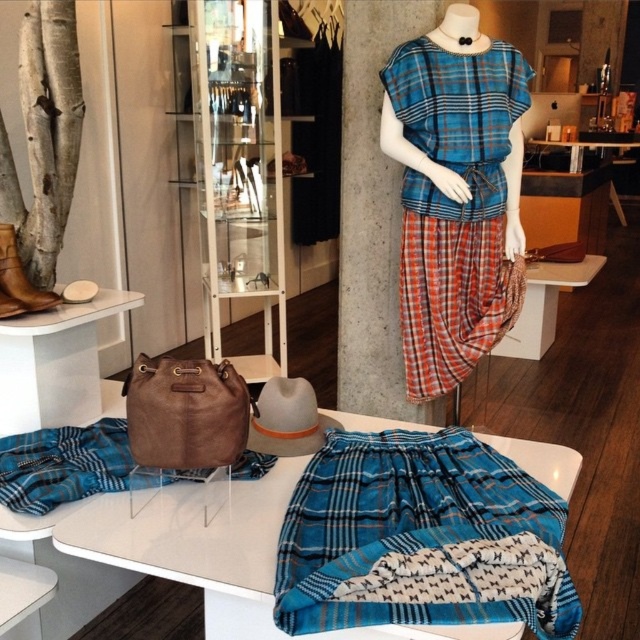
Can you confirm if blue plaid skirt at center is positioned above blue plaid dress at center?

No.

Is point (342, 496) behind point (449, 212)?

No, (342, 496) is closer to viewer.

Is point (390, 509) positioned in front of point (456, 49)?

Yes, it is in front of point (456, 49).

Locate an element on the screen. This screenshot has width=640, height=640. blue plaid skirt at center is located at coordinates (420, 538).

Is point (449, 349) positioned after point (13, 262)?

Yes.

Between blue plaid dress at center and brown leather boot at left, which one is positioned lower?

Positioned lower is brown leather boot at left.

I want to click on blue plaid dress at center, so click(454, 192).

This screenshot has height=640, width=640. Find the location of `blue plaid dress at center`. blue plaid dress at center is located at coordinates (454, 192).

Does blue plaid skirt at center appear on the right side of suede plaid skirt at lower left?

Yes, blue plaid skirt at center is to the right of suede plaid skirt at lower left.

Is point (362, 572) farther from camera compared to point (13, 435)?

No, it is in front of (13, 435).

Locate an element on the screen. Image resolution: width=640 pixels, height=640 pixels. blue plaid skirt at center is located at coordinates (420, 538).

At what (x,y) coordinates should I click in order to perform the action: click on blue plaid skirt at center. Please return your answer as a coordinate pair (x, y). The width and height of the screenshot is (640, 640). Looking at the image, I should click on (420, 538).